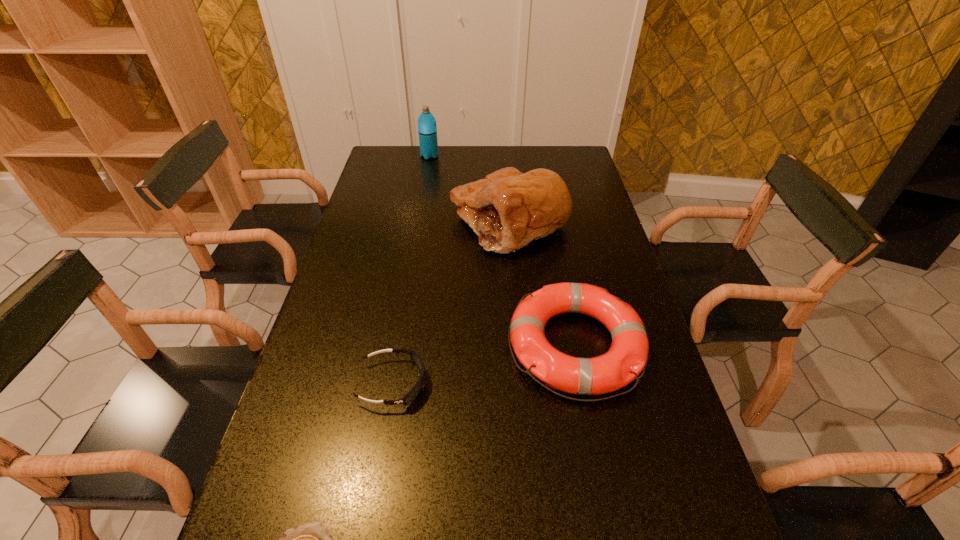
Find the location of a particular element. Image resolution: width=960 pixels, height=540 pixels. the farthest object is located at coordinates (427, 130).

Where is `the fourth nearest object`? the fourth nearest object is located at coordinates (508, 209).

Locate an element on the screen. The width and height of the screenshot is (960, 540). life buoy is located at coordinates (628, 355).

Image resolution: width=960 pixels, height=540 pixels. I want to click on goggles, so click(416, 358).

Find the location of a particular element. free point located 0.130m on the front of the farthest object is located at coordinates click(426, 177).

Locate an element on the screen. This screenshot has height=540, width=960. vacant area located on the filling side of the fourth nearest object is located at coordinates (426, 222).

You are a GUI agent. You are given a task and a screenshot of the screen. Output one action in this format:
    pyautogui.click(x=<x>, y=<y>)
    Task: Click on the free spot located on the filling side of the fourth nearest object
    Image resolution: width=960 pixels, height=540 pixels.
    Given the screenshot: What is the action you would take?
    pyautogui.click(x=405, y=222)

Where is `vacant space situated 0.310m on the filling side of the fourth nearest object`? This screenshot has height=540, width=960. vacant space situated 0.310m on the filling side of the fourth nearest object is located at coordinates (358, 222).

What are the coordinates of `vacant position located on the front of the life buoy` in the screenshot? It's located at point(611,525).

Locate an element on the screen. The width and height of the screenshot is (960, 540). free spot located on the front and sides of the second shortest object is located at coordinates (563, 383).